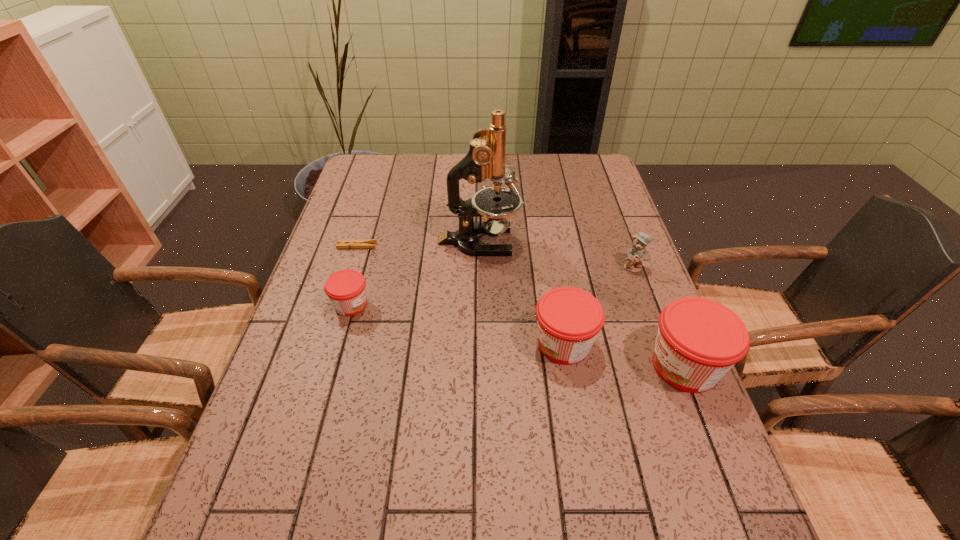
To ensure equal spacing by inserting another jam among them, please point out a vacant spot for this new jam. Please provide its 2D coordinates. Your answer should be formatted as a tuple, i.e. [(x, y)], where the tuple contains the x and y coordinates of a point satisfying the conditions above.

[(453, 323)]